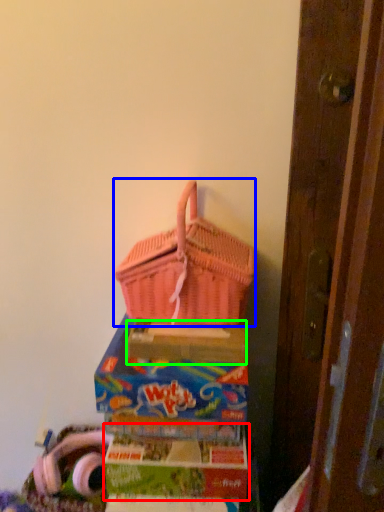
Question: Considering the real-world distances, which object is closest to box (highlighted by a red box)? picnic basket (highlighted by a blue box) or cardboard box (highlighted by a green box).

Choices:
 (A) picnic basket
 (B) cardboard box

Answer: (B)